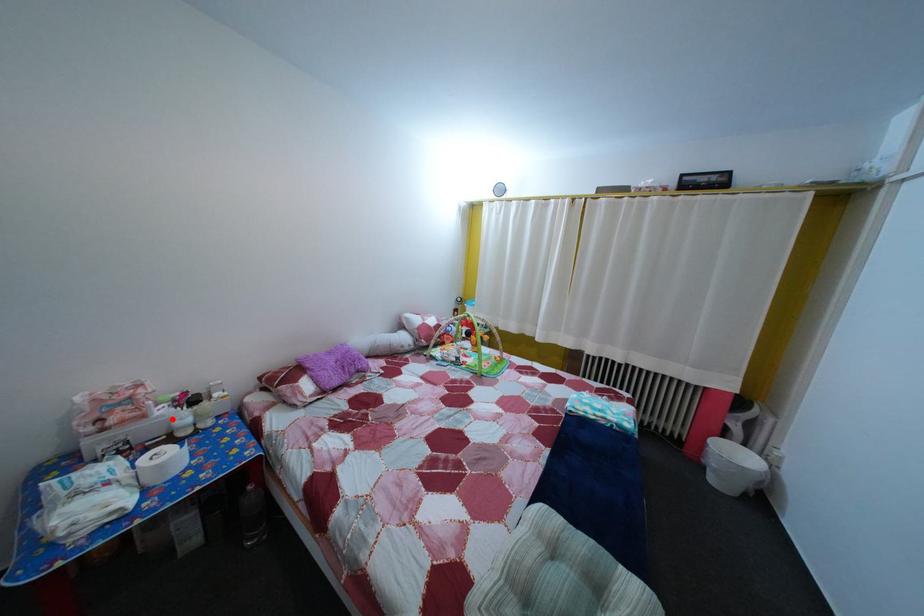
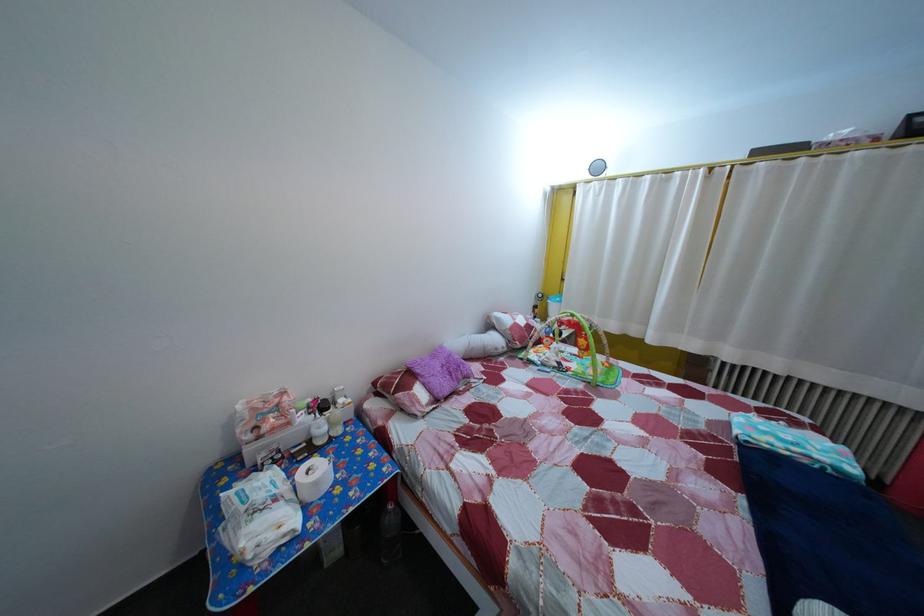
The point at the highlighted location is marked in the first image. Where is the corresponding point in the second image?

(311, 427)